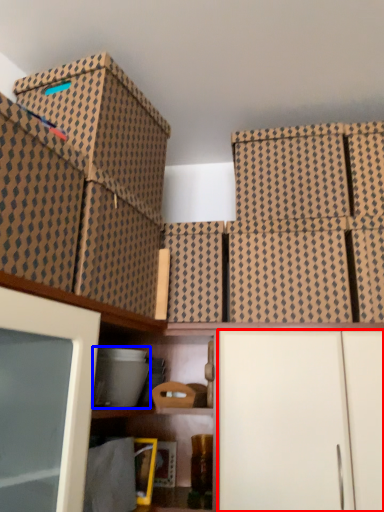
Question: Among these objects, which one is farthest to the camera, cabinetry (highlighted by a red box) or storage box (highlighted by a blue box)?

Choices:
 (A) cabinetry
 (B) storage box

Answer: (B)